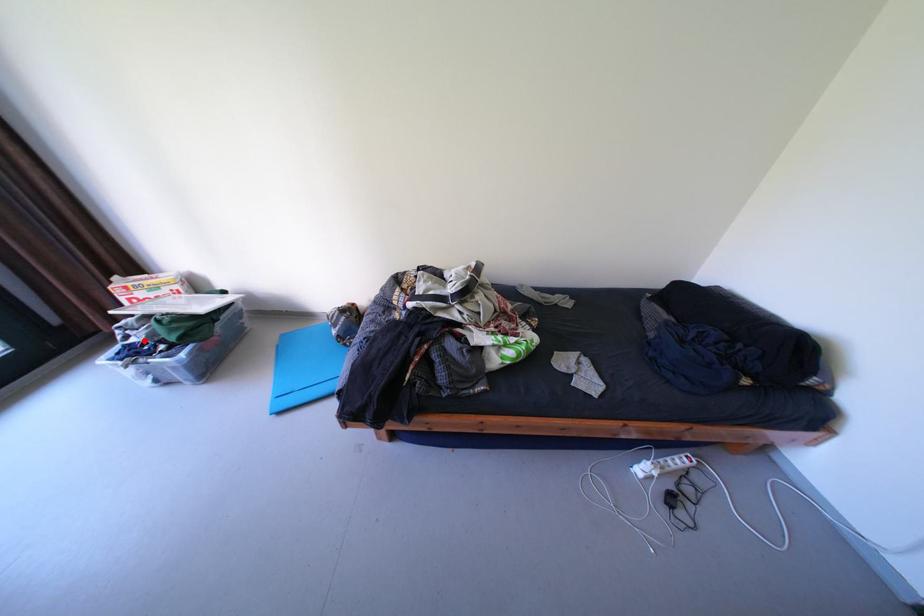
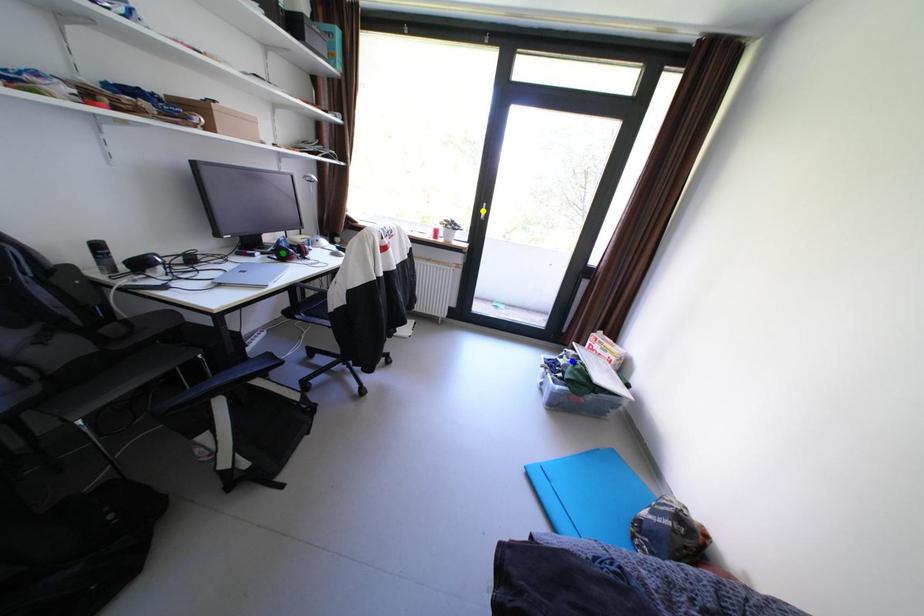
Question: I am providing you with two images of the same scene from different viewpoints. A red point is marked on the first image. You are given multiple points on the second image. In image 2, which mark is for the same physical point as the one in image 1?

Choices:
 (A) green point
 (B) blue point
 (C) yellow point

Answer: (B)